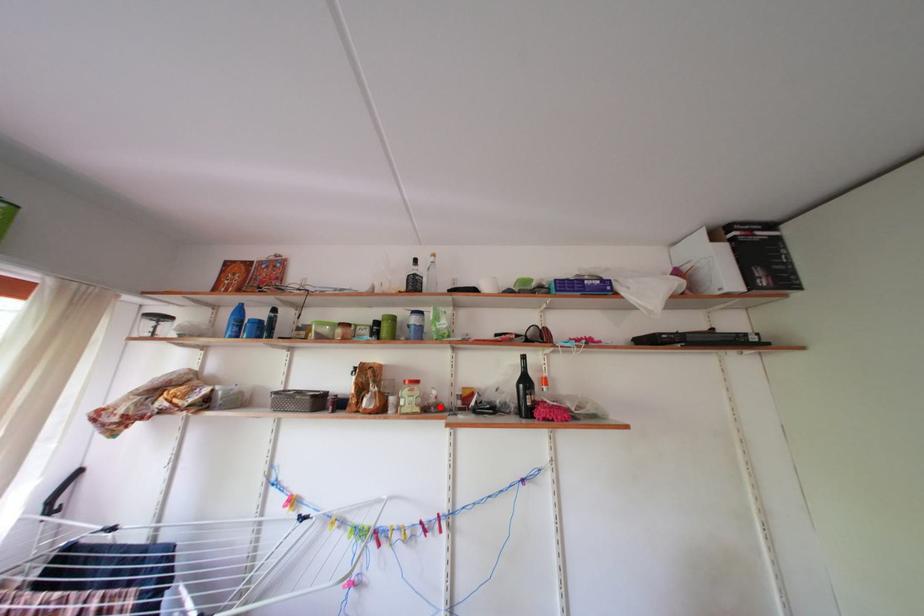
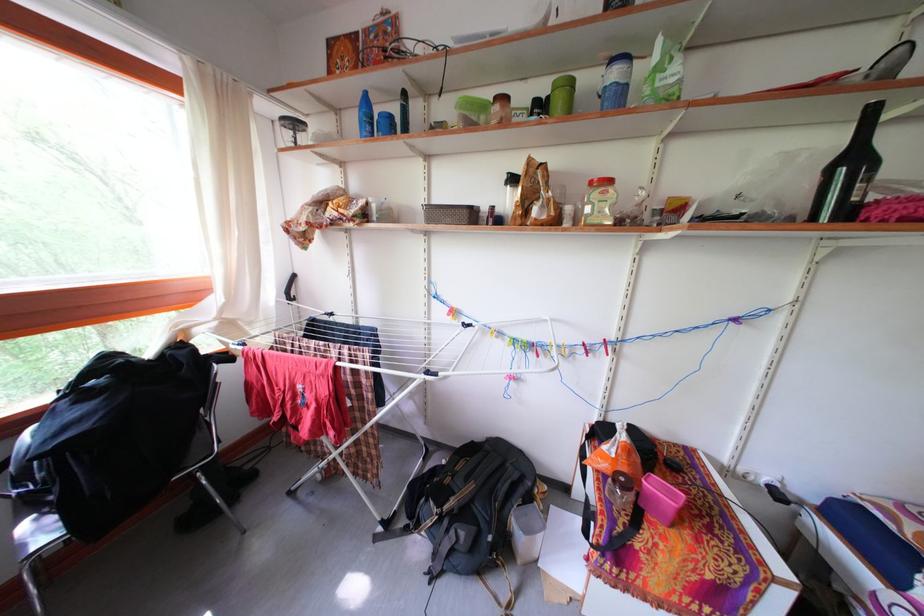
Question: I am providing you with two images of the same scene from different viewpoints. Image1 has a red point marked. In image2, the corresponding 3D location appears at what relative position? Reply with the corresponding letter.

Choices:
 (A) Closer
 (B) Farther

Answer: (A)